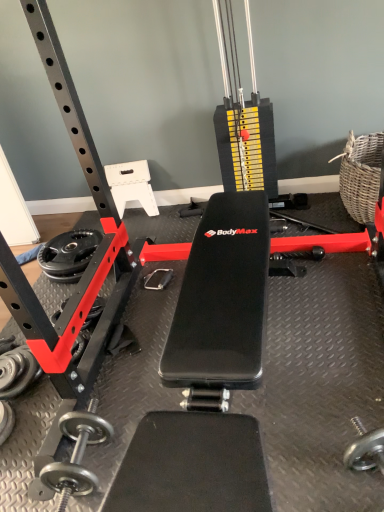
Question: From a real-world perspective, is black rubber dumbbell at lower left, which is the 2th dumbbell from bottom to top, located beneath silver metallic dumbbell at lower left, the second dumbbell in the top-to-bottom sequence?

Choices:
 (A) no
 (B) yes

Answer: (A)

Question: Considering the relative sizes of black rubber dumbbell at lower left, acting as the 1th dumbbell starting from the top, and silver metallic dumbbell at lower left, the second dumbbell in the top-to-bottom sequence, in the image provided, is black rubber dumbbell at lower left, acting as the 1th dumbbell starting from the top, smaller than silver metallic dumbbell at lower left, the second dumbbell in the top-to-bottom sequence,?

Choices:
 (A) yes
 (B) no

Answer: (B)

Question: Is black rubber dumbbell at lower left, acting as the 1th dumbbell starting from the top, closer to the viewer compared to silver metallic dumbbell at lower left, the first dumbbell positioned from the bottom?

Choices:
 (A) yes
 (B) no

Answer: (B)

Question: Could you tell me if black rubber dumbbell at lower left, which is the 2th dumbbell from bottom to top, is turned towards silver metallic dumbbell at lower left, the second dumbbell in the top-to-bottom sequence?

Choices:
 (A) no
 (B) yes

Answer: (A)

Question: Does black rubber dumbbell at lower left, acting as the 1th dumbbell starting from the top, appear on the left side of silver metallic dumbbell at lower left, the first dumbbell positioned from the bottom?

Choices:
 (A) no
 (B) yes

Answer: (A)

Question: Relative to silver metallic dumbbell at lower left, the second dumbbell in the top-to-bottom sequence, is black rubber weight plate at lower left in front or behind?

Choices:
 (A) behind
 (B) front

Answer: (A)

Question: From a real-world perspective, relative to silver metallic dumbbell at lower left, the second dumbbell in the top-to-bottom sequence, is black rubber weight plate at lower left vertically above or below?

Choices:
 (A) above
 (B) below

Answer: (A)

Question: Visually, is black rubber weight plate at lower left positioned to the left or to the right of silver metallic dumbbell at lower left, the first dumbbell positioned from the bottom?

Choices:
 (A) right
 (B) left

Answer: (A)

Question: Which is correct: black rubber weight plate at lower left is inside silver metallic dumbbell at lower left, the second dumbbell in the top-to-bottom sequence, or outside of it?

Choices:
 (A) inside
 (B) outside

Answer: (B)

Question: Is black rubber dumbbell at lower left, which is the 2th dumbbell from bottom to top, wider or thinner than silver metallic dumbbell at lower left, the second dumbbell in the top-to-bottom sequence?

Choices:
 (A) thin
 (B) wide

Answer: (A)

Question: Is point tap(26, 352) positioned closer to the camera than point tap(9, 429)?

Choices:
 (A) closer
 (B) farther

Answer: (B)

Question: Would you say black rubber dumbbell at lower left, which is the 2th dumbbell from bottom to top, is inside or outside silver metallic dumbbell at lower left, the first dumbbell positioned from the bottom?

Choices:
 (A) inside
 (B) outside

Answer: (B)

Question: From the image's perspective, is black rubber dumbbell at lower left, which is the 2th dumbbell from bottom to top, positioned above or below silver metallic dumbbell at lower left, the first dumbbell positioned from the bottom?

Choices:
 (A) below
 (B) above

Answer: (B)

Question: Visually, is black rubber dumbbell at lower left, which is the 2th dumbbell from bottom to top, positioned to the left or to the right of black rubber weight plate at lower left?

Choices:
 (A) right
 (B) left

Answer: (B)

Question: Is black rubber dumbbell at lower left, acting as the 1th dumbbell starting from the top, in front of or behind black rubber weight plate at lower left in the image?

Choices:
 (A) behind
 (B) front

Answer: (B)